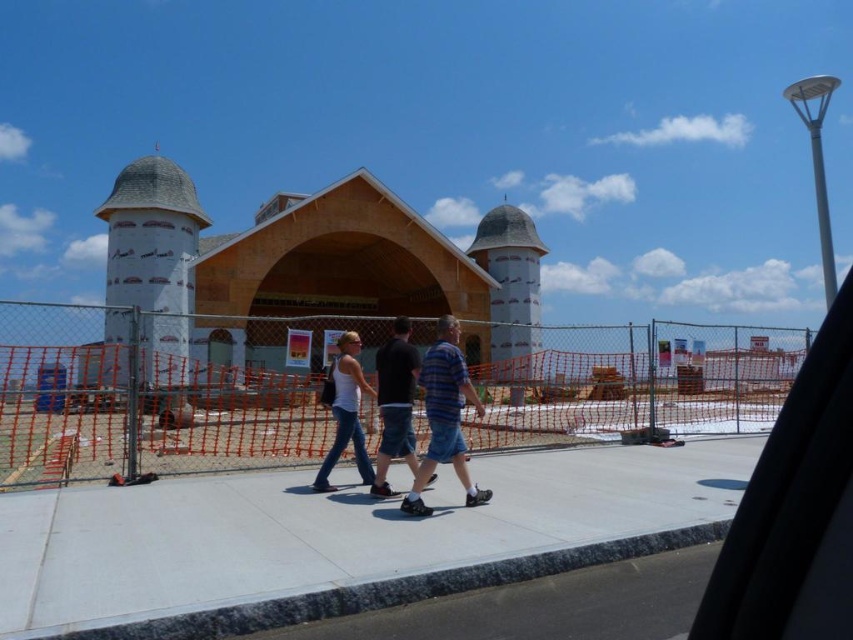
Question: Does transparent glass car window at upper right have a lesser width compared to dark blue denim shorts at center?

Choices:
 (A) no
 (B) yes

Answer: (A)

Question: Which object is the farthest from the gray concrete sidewalk at center?

Choices:
 (A) dark blue denim shorts at center
 (B) striped cotton shirt at center

Answer: (A)

Question: Does denim shorts at center appear on the left side of white matte tank top at center?

Choices:
 (A) no
 (B) yes

Answer: (A)

Question: Estimate the real-world distances between objects in this image. Which object is closer to the striped cotton shirt at center?

Choices:
 (A) denim shorts at center
 (B) transparent glass car window at upper right

Answer: (A)

Question: Among these points, which one is nearest to the camera?

Choices:
 (A) (268, 499)
 (B) (370, 490)
 (C) (363, 449)

Answer: (A)

Question: Observing the image, what is the correct spatial positioning of denim shorts at center in reference to dark blue denim shorts at center?

Choices:
 (A) right
 (B) left

Answer: (A)